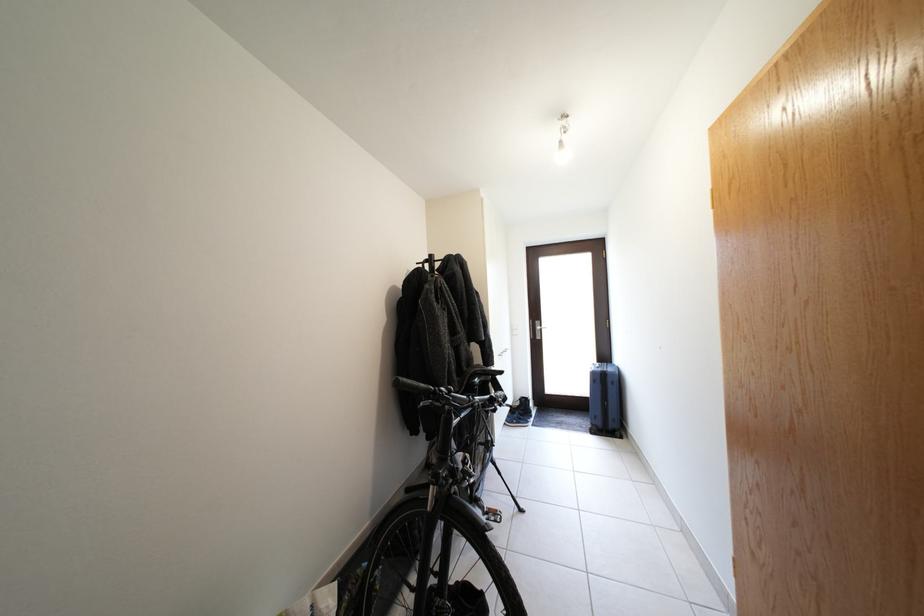
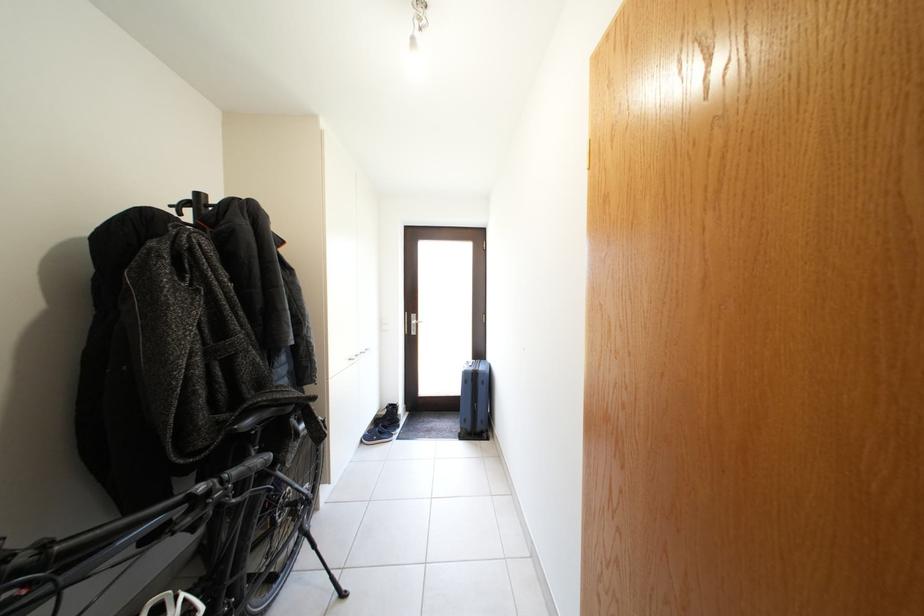
Where in the second image is the point corresponding to point 528,419 from the first image?

(392, 431)